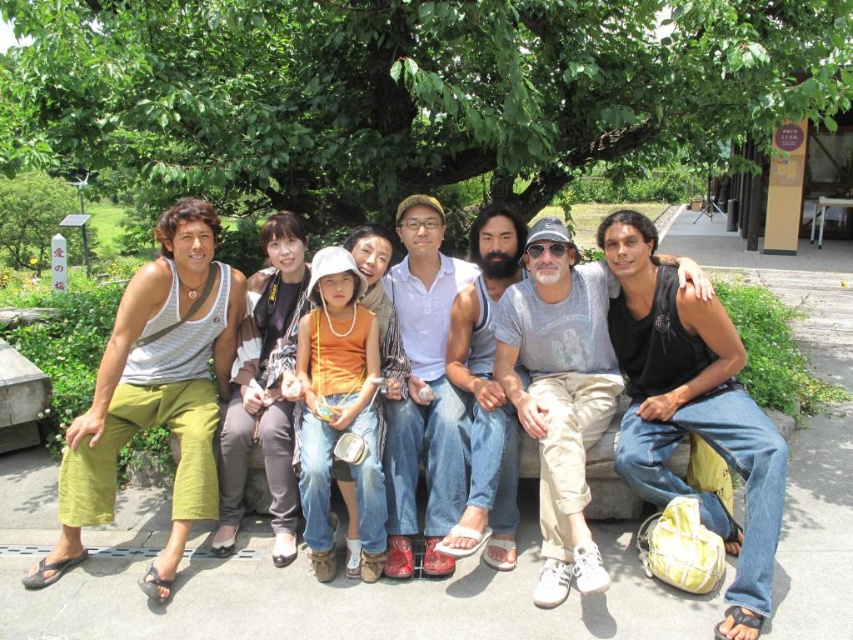
Question: Which object is closer to the camera taking this photo?

Choices:
 (A) green leafy tree at upper center
 (B) green leafy tree at left

Answer: (A)

Question: Does green leafy tree at upper center appear under green leafy tree at left?

Choices:
 (A) no
 (B) yes

Answer: (B)

Question: Is green leafy tree at upper center smaller than green leafy tree at left?

Choices:
 (A) no
 (B) yes

Answer: (A)

Question: Is green leafy tree at upper center below green leafy tree at left?

Choices:
 (A) yes
 (B) no

Answer: (A)